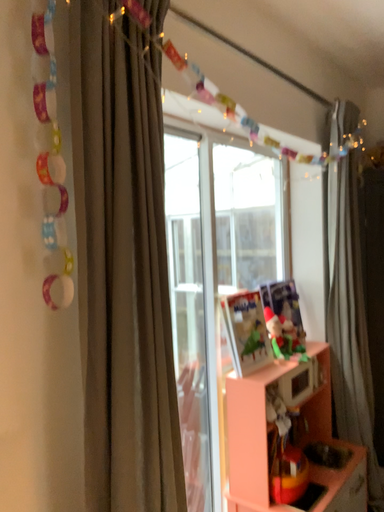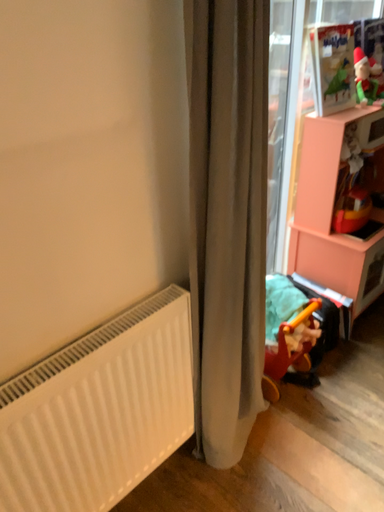
Question: How did the camera likely rotate when shooting the video?

Choices:
 (A) rotated left
 (B) rotated right

Answer: (A)